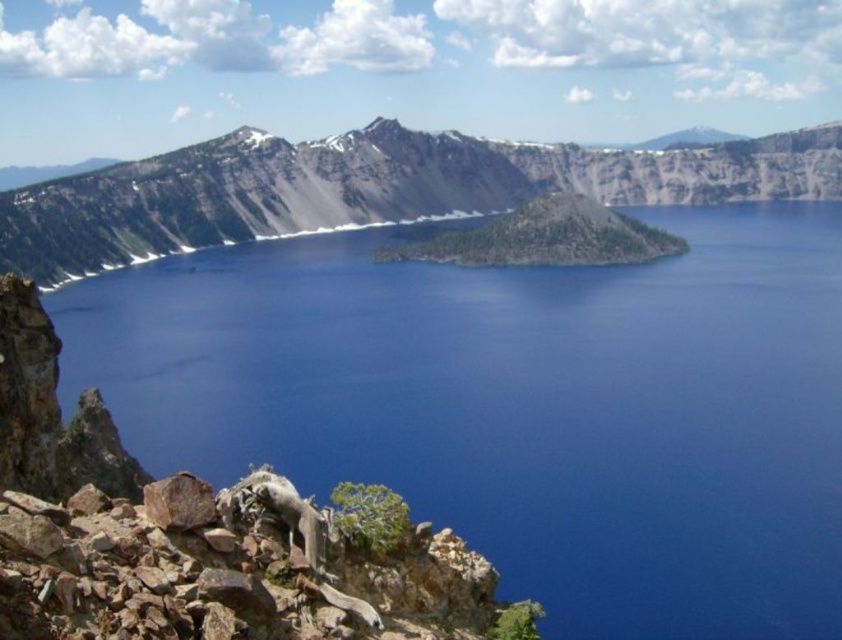
Measure the distance from blue water at center to gray rocky mountain at center.

blue water at center and gray rocky mountain at center are 100.70 meters apart.

Between blue water at center and gray rocky mountain at center, which one is positioned lower?

blue water at center

Based on the photo, who is more distant from viewer, (220, 396) or (809, 164)?

Point (809, 164)

Where is `blue water at center`? The height and width of the screenshot is (640, 842). blue water at center is located at coordinates (520, 406).

Between point (467, 188) and point (292, 493), which one is positioned in front?

Point (292, 493)

Where is `gray rocky mountain at center`? gray rocky mountain at center is located at coordinates (370, 188).

Is rusty rock at lower left further to camera compared to gray rocky mountain at center?

No, rusty rock at lower left is in front of gray rocky mountain at center.

Is rusty rock at lower left wider than gray rocky mountain at center?

No.

Locate an element on the screen. This screenshot has width=842, height=640. rusty rock at lower left is located at coordinates (195, 538).

Locate an element on the screen. rusty rock at lower left is located at coordinates (195, 538).